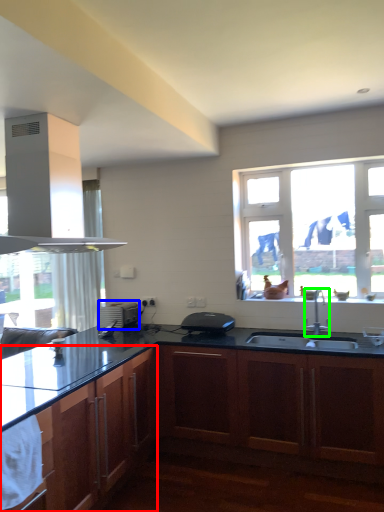
Question: Which object is positioned farthest from cabinetry (highlighted by a red box)? Select from appliance (highlighted by a blue box) and faucet (highlighted by a green box).

Choices:
 (A) appliance
 (B) faucet

Answer: (B)